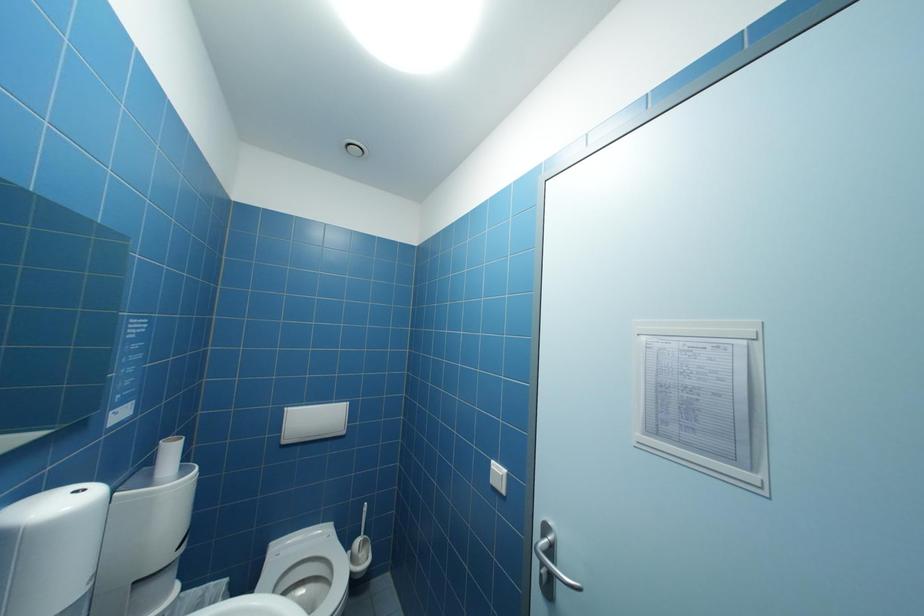
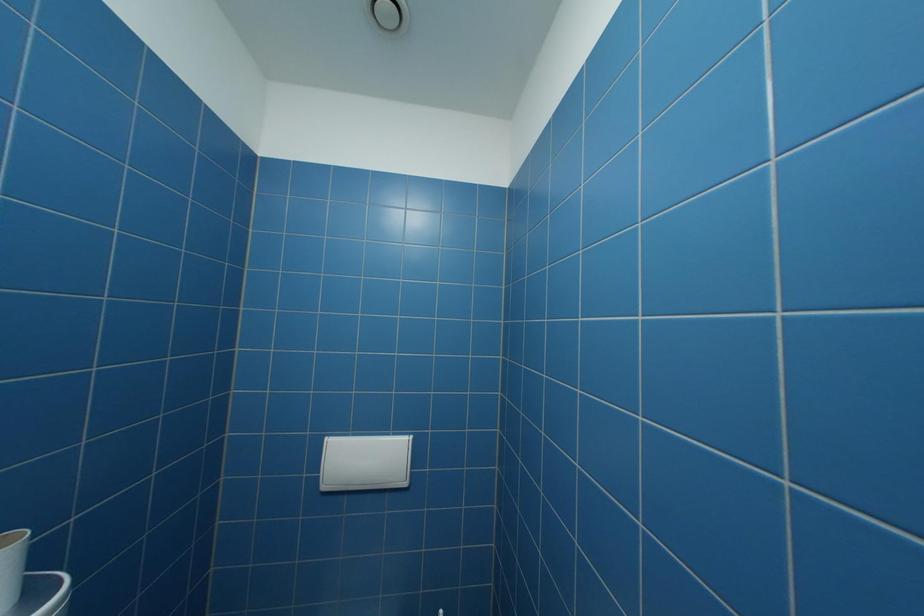
Question: The first image is from the beginning of the video and the second image is from the end. How did the camera likely rotate when shooting the video?

Choices:
 (A) Left
 (B) Right
 (C) Up
 (D) Down

Answer: (A)